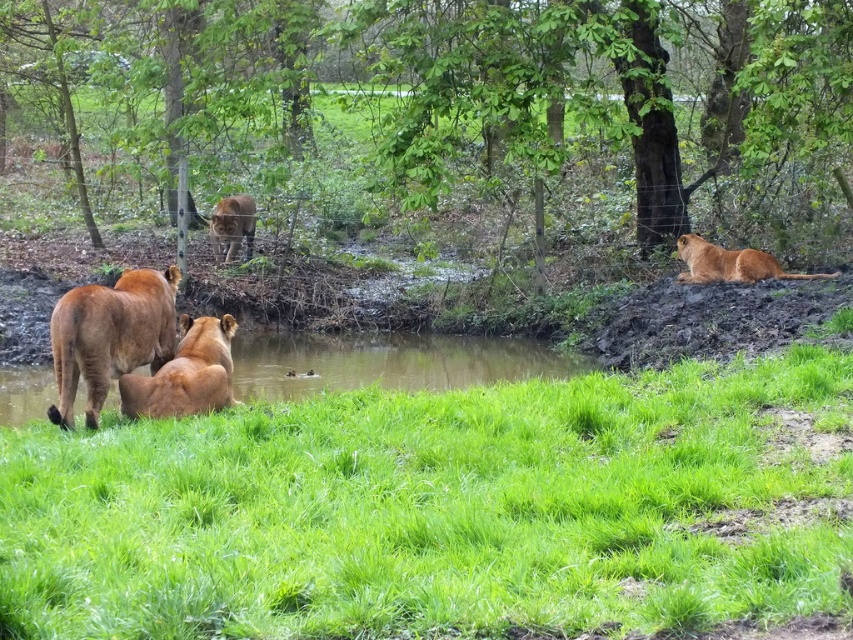
Which is below, brown textured tree at upper center or golden fur lion at center?

golden fur lion at center is below.

From the picture: Is brown textured tree at upper center smaller than golden fur lion at center?

Incorrect, brown textured tree at upper center is not smaller in size than golden fur lion at center.

Where is `brown textured tree at upper center`? Image resolution: width=853 pixels, height=640 pixels. brown textured tree at upper center is located at coordinates (445, 92).

Find the location of `brown textured tree at upper center`. brown textured tree at upper center is located at coordinates (445, 92).

Is point (241, 44) more distant than point (683, 234)?

No, it is in front of (683, 234).

The width and height of the screenshot is (853, 640). Describe the element at coordinates (445, 92) in the screenshot. I see `brown textured tree at upper center` at that location.

Which is in front, point (567, 6) or point (764, 266)?

Point (567, 6) is in front.

Where is `brown textured tree at upper center`? brown textured tree at upper center is located at coordinates (445, 92).

Is brown fur lion at lower left to the left of brown furry lion at center from the viewer's perspective?

In fact, brown fur lion at lower left is to the right of brown furry lion at center.

The height and width of the screenshot is (640, 853). What do you see at coordinates (109, 337) in the screenshot?
I see `brown fur lion at lower left` at bounding box center [109, 337].

Is point (154, 289) positioned before point (223, 218)?

Yes, it is in front of point (223, 218).

Image resolution: width=853 pixels, height=640 pixels. Identify the location of brown fur lion at lower left. (109, 337).